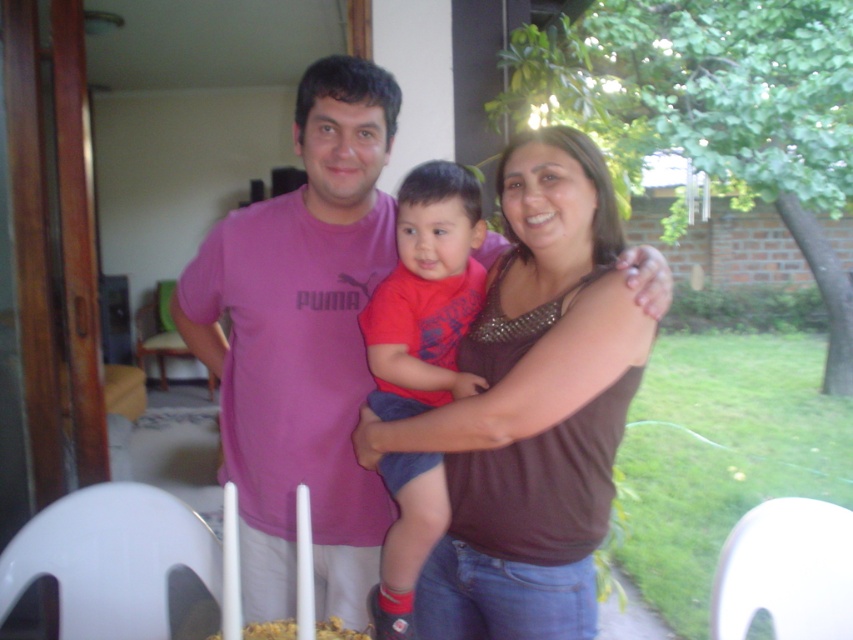
You are a photographer setting up for a family portrait. The scene includes a brown textured tank top at center and a red cotton shirt at center. Since you want to ensure both subjects are visible, which clothing item should you focus on first to accommodate their sizes?

The brown textured tank top at center is wider than the red cotton shirt at center, so you should focus on the brown textured tank top at center first to ensure it fits within the frame.